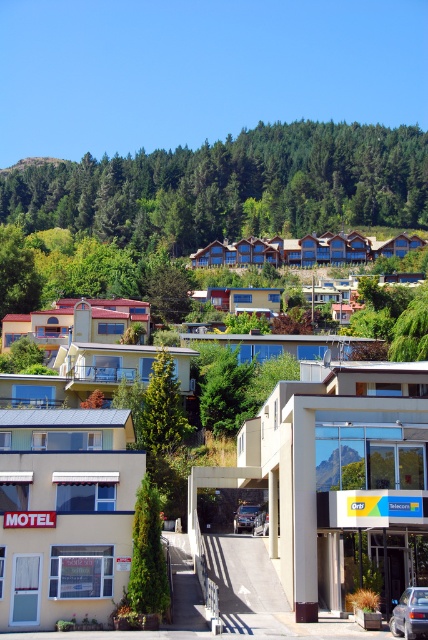
Question: Among these objects, which one is farthest from the camera?

Choices:
 (A) beige matte motel at lower left
 (B) beige concrete building at center
 (C) metallic silver sedan at lower right

Answer: (B)

Question: Among these objects, which one is nearest to the camera?

Choices:
 (A) metallic silver car at center
 (B) blue wooden hotel at center
 (C) metallic silver sedan at lower right
 (D) beige matte motel at lower left

Answer: (C)

Question: Is beige concrete building at center to the left of beige matte motel at lower left from the viewer's perspective?

Choices:
 (A) yes
 (B) no

Answer: (B)

Question: Can you confirm if beige concrete building at center is positioned above metallic silver sedan at lower right?

Choices:
 (A) no
 (B) yes

Answer: (B)

Question: Which point is farther to the camera?

Choices:
 (A) metallic silver car at center
 (B) beige concrete building at center

Answer: (A)

Question: Where is beige concrete building at center located in relation to metallic silver car at center in the image?

Choices:
 (A) right
 (B) left

Answer: (A)